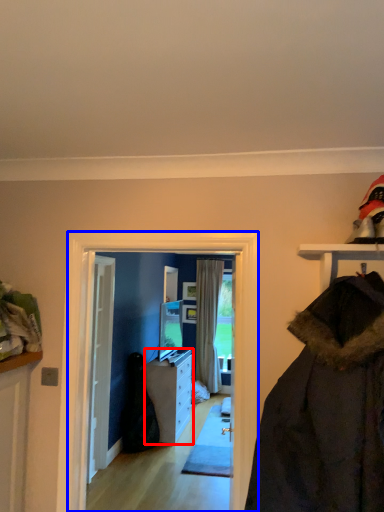
Question: Which object is further to the camera taking this photo, cabinetry (highlighted by a red box) or screen door (highlighted by a blue box)?

Choices:
 (A) cabinetry
 (B) screen door

Answer: (A)